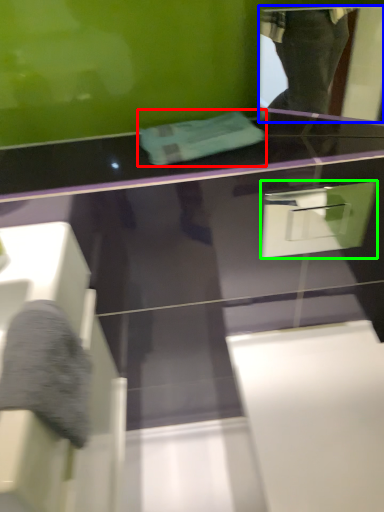
Question: Which is farther away from towel (highlighted by a red box)? mirror (highlighted by a blue box) or drawer (highlighted by a green box)?

Choices:
 (A) mirror
 (B) drawer

Answer: (A)